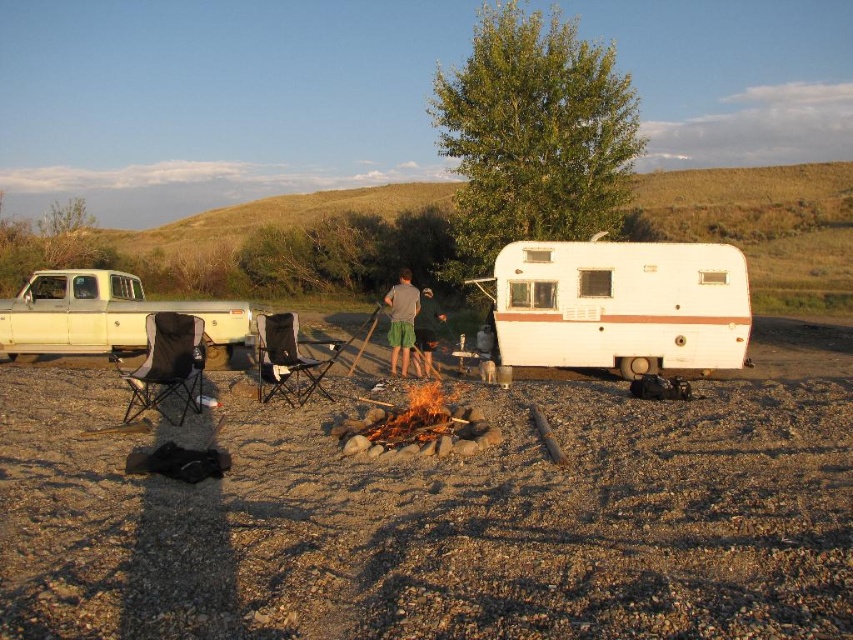
Question: Does matte white truck at left appear under gray fabric shorts at center?

Choices:
 (A) yes
 (B) no

Answer: (A)

Question: Which object appears farthest from the camera in this image?

Choices:
 (A) matte white truck at left
 (B) white matte camper at center
 (C) dark gray fabric pants at center

Answer: (A)

Question: Which point is farther to the camera?

Choices:
 (A) dirt gravel at center
 (B) gray fabric shorts at center
 (C) matte white truck at left

Answer: (C)

Question: Is white matte camper at center further to the viewer compared to dark gray fabric pants at center?

Choices:
 (A) no
 (B) yes

Answer: (A)

Question: Can you confirm if black mesh chair at lower left is wider than dark gray fabric pants at center?

Choices:
 (A) yes
 (B) no

Answer: (A)

Question: Which of the following is the closest to the observer?

Choices:
 (A) matte white truck at left
 (B) black mesh chair at lower left

Answer: (B)